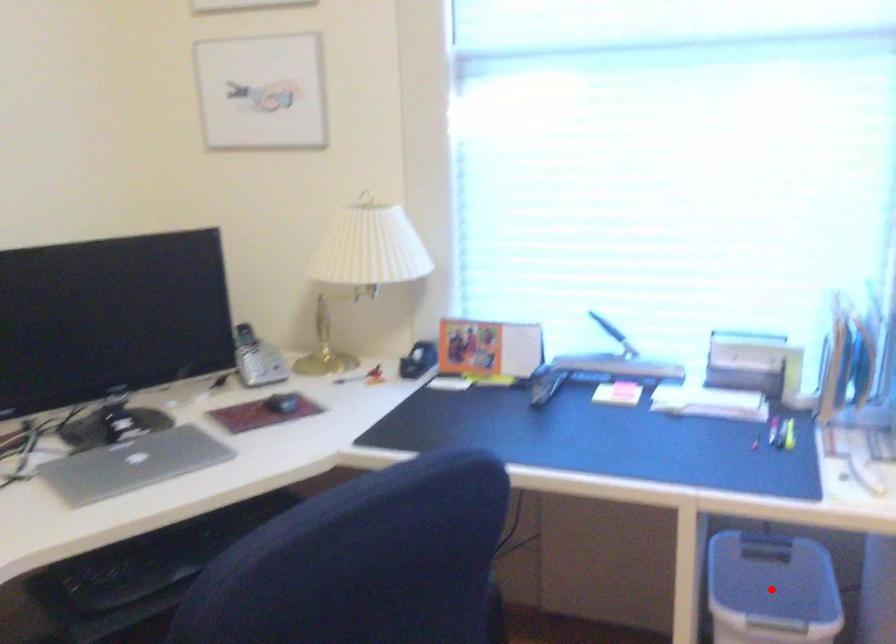
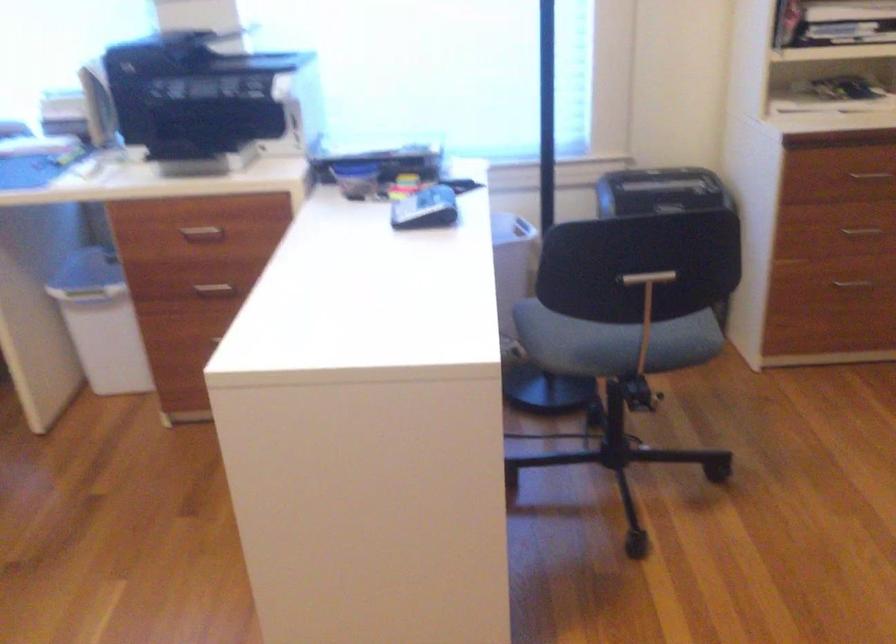
Question: I am providing you with two images of the same scene from different viewpoints. A red point is marked on the first image. Can you still see the location of the red point in image 2?

Choices:
 (A) Yes
 (B) No

Answer: (B)